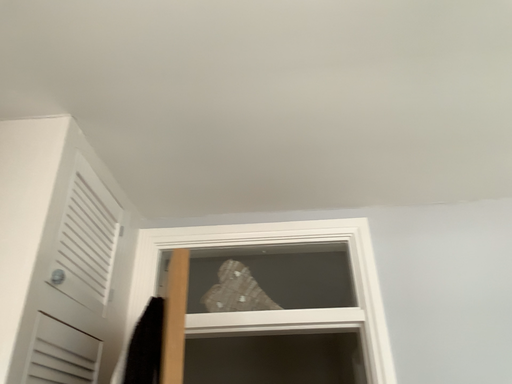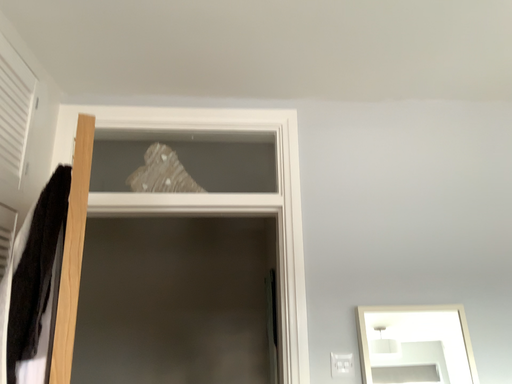
Question: How did the camera likely rotate when shooting the video?

Choices:
 (A) rotated right
 (B) rotated left

Answer: (A)